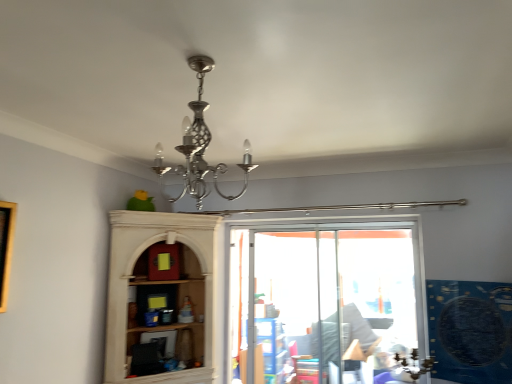
Question: Is polished silver chandelier at center to the right of wooden picture frame at left from the viewer's perspective?

Choices:
 (A) yes
 (B) no

Answer: (A)

Question: Is polished silver chandelier at center positioned far away from wooden picture frame at left?

Choices:
 (A) yes
 (B) no

Answer: (A)

Question: Is polished silver chandelier at center facing towards wooden picture frame at left?

Choices:
 (A) no
 (B) yes

Answer: (A)

Question: From a real-world perspective, is polished silver chandelier at center beneath wooden picture frame at left?

Choices:
 (A) no
 (B) yes

Answer: (A)

Question: Would you say wooden picture frame at left is part of polished silver chandelier at center's contents?

Choices:
 (A) no
 (B) yes

Answer: (A)

Question: Considering the relative positions of polished silver chandelier at center and wooden picture frame at left in the image provided, is polished silver chandelier at center to the left or to the right of wooden picture frame at left?

Choices:
 (A) right
 (B) left

Answer: (A)

Question: Is polished silver chandelier at center wider or thinner than wooden picture frame at left?

Choices:
 (A) thin
 (B) wide

Answer: (B)

Question: Is polished silver chandelier at center in front of or behind wooden picture frame at left in the image?

Choices:
 (A) front
 (B) behind

Answer: (A)

Question: From the image's perspective, is polished silver chandelier at center located above or below wooden picture frame at left?

Choices:
 (A) above
 (B) below

Answer: (A)

Question: From a real-world perspective, is blue plastic shelf at center positioned above or below wooden picture frame at left?

Choices:
 (A) below
 (B) above

Answer: (A)

Question: In the image, is blue plastic shelf at center positioned in front of or behind wooden picture frame at left?

Choices:
 (A) behind
 (B) front

Answer: (A)

Question: Considering the positions of point (272, 337) and point (0, 284), is point (272, 337) closer or farther from the camera than point (0, 284)?

Choices:
 (A) closer
 (B) farther

Answer: (B)

Question: Is blue plastic shelf at center taller or shorter than wooden picture frame at left?

Choices:
 (A) tall
 (B) short

Answer: (A)

Question: In terms of width, does polished silver chandelier at center look wider or thinner when compared to blue plastic shelf at center?

Choices:
 (A) wide
 (B) thin

Answer: (A)

Question: From a real-world perspective, is polished silver chandelier at center positioned above or below blue plastic shelf at center?

Choices:
 (A) below
 (B) above

Answer: (B)